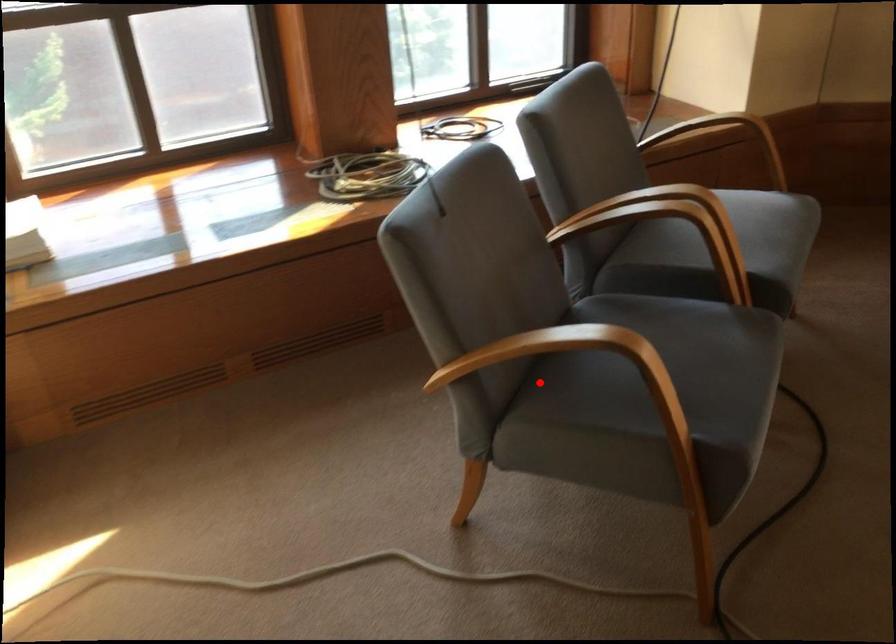
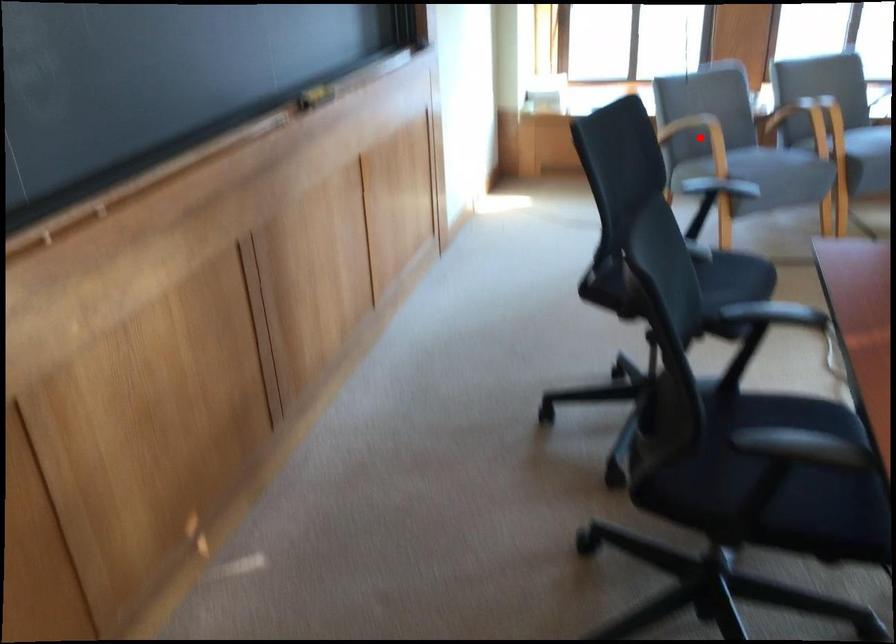
I am providing you with two images of the same scene from different viewpoints. A red point is marked on the first image and another point is marked on the second image. Is the marked point in image1 the same physical position as the marked point in image2?

Yes